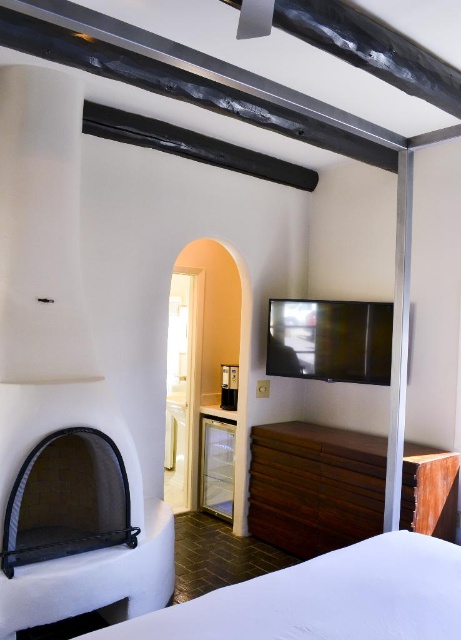
You are moving a large piece of furniture into a room. The room has a dark brown wood dresser at center and a black mesh fireplace at lower left. Which object should you avoid placing a heavy item on top of, considering their size?

The dark brown wood dresser at center is bigger than the black mesh fireplace at lower left, so it can support heavier items. Avoid placing heavy items on the black mesh fireplace at lower left.

You are standing at the entrance of the room and want to reach the white soft bed at lower right. Which direction should you move relative to the fireplace?

The white soft bed at lower right is located at point (325,598), which is to the right and slightly below the fireplace. Move towards the right side of the fireplace to reach the bed.

You are standing at the entrance of the room and want to move towards the white soft bed at lower right. However, there is a dark brown wood dresser at center in your path. Can you walk around the dresser to reach the bed without moving any furniture?

The white soft bed at lower right is in front of the dark brown wood dresser at center, so you can walk around the dresser to reach the bed without moving any furniture.